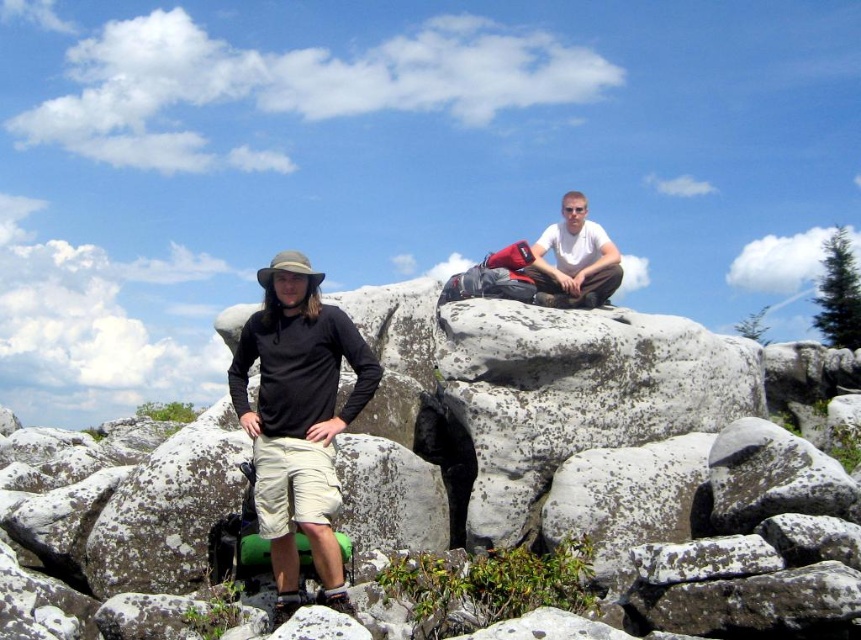
You are a photographer planning to take a landscape photo of the rocky outcrop. You need to ensure both the black matte shirt at center and the white matte shirt at upper center are visible in the frame. Based on their positions, which shirt should appear higher in the photo?

The white matte shirt at upper center should appear higher in the photo because it is positioned above the black matte shirt at center.

You are a photographer planning to take a photo of the two people in the scene. You want to ensure both the black matte shirt at center and the white matte shirt at upper center are clearly visible. Based on their positions, which person should you focus on to ensure both are in focus?

You should focus on the white matte shirt at upper center because the black matte shirt at center is in front of it, so focusing on the background subject might keep both in focus.